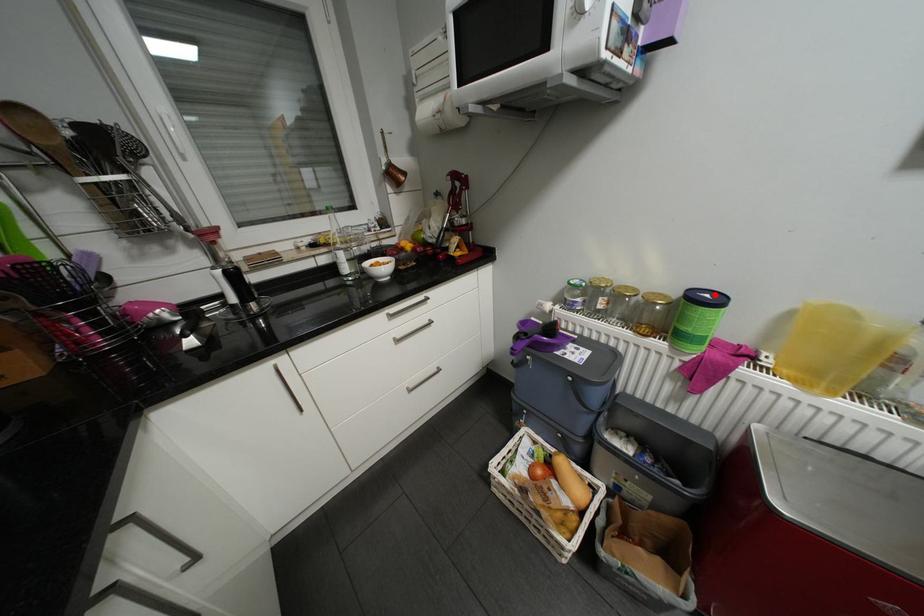
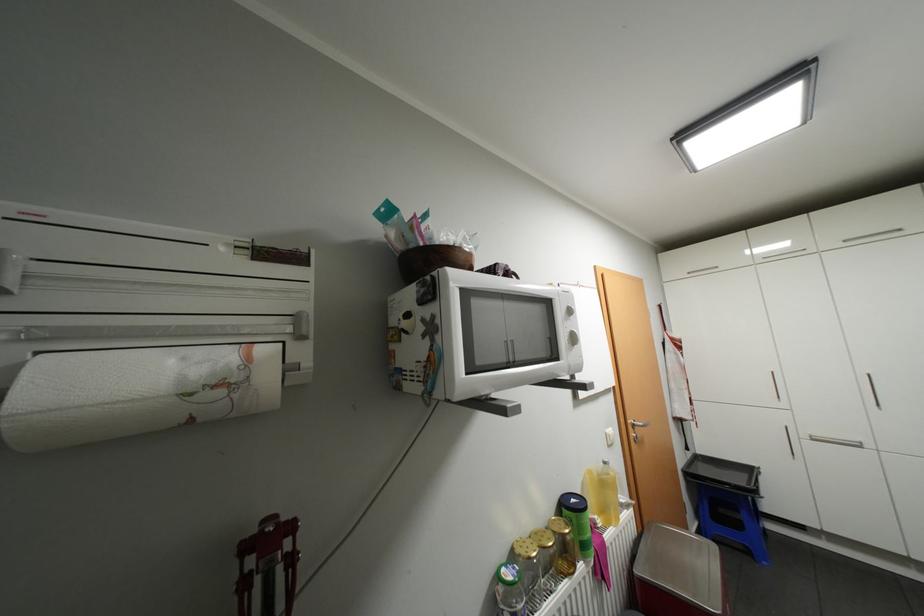
Where in the second image is the point corresponding to the highlighted location from the first image?

(580, 499)